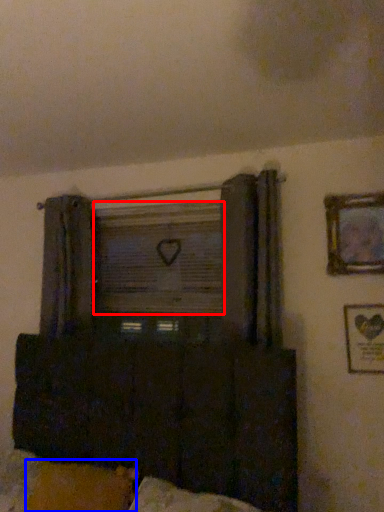
Question: Which object appears farthest to the camera in this image, window screen (highlighted by a red box) or pillow (highlighted by a blue box)?

Choices:
 (A) window screen
 (B) pillow

Answer: (A)